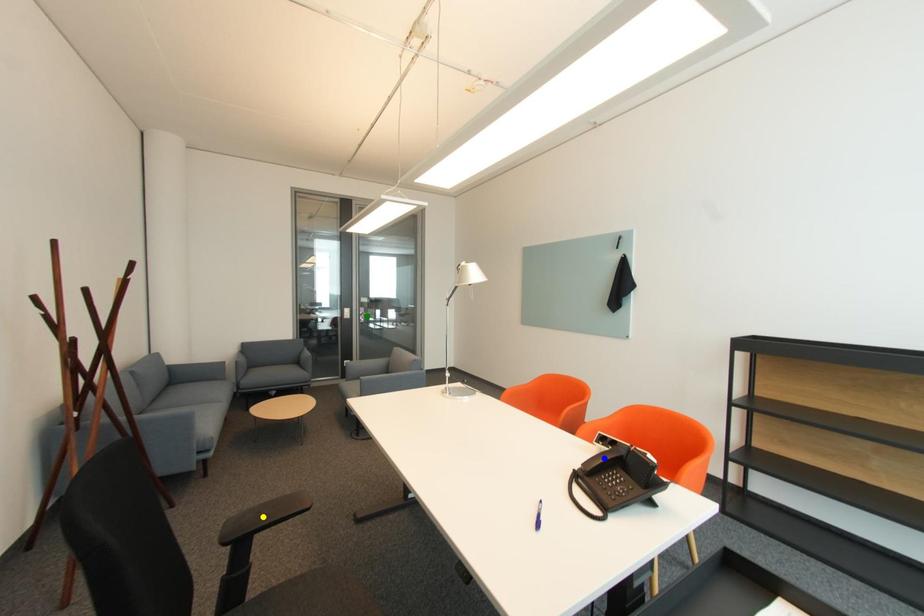
Order these from nearest to farthest:
blue point | green point | yellow point

blue point, yellow point, green point